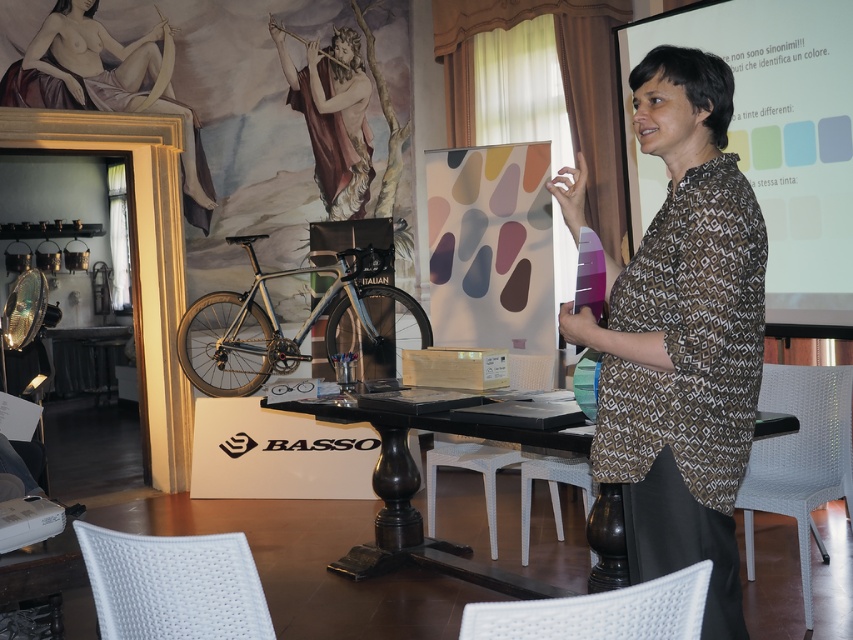
Question: Among these points, which one is farthest from the camera?

Choices:
 (A) (318, 90)
 (B) (567, 442)

Answer: (A)

Question: Is silver metallic bicycle at center thinner than matte gold frame at upper left?

Choices:
 (A) no
 (B) yes

Answer: (A)

Question: Is matte gold frame at upper left below matte gold flute at upper center?

Choices:
 (A) yes
 (B) no

Answer: (A)

Question: Which is farther from the silver metallic bicycle at center?

Choices:
 (A) matte gold frame at upper left
 (B) brown printed shirt at center
 (C) black glossy table at center
 (D) matte gold flute at upper center

Answer: (B)

Question: Can you confirm if white paper at upper right is smaller than matte gold frame at upper left?

Choices:
 (A) no
 (B) yes

Answer: (A)

Question: Based on their relative distances, which object is farther from the brown printed shirt at center?

Choices:
 (A) matte gold frame at upper left
 (B) white paper at upper right
 (C) silver metallic bicycle at center
 (D) matte gold flute at upper center

Answer: (A)